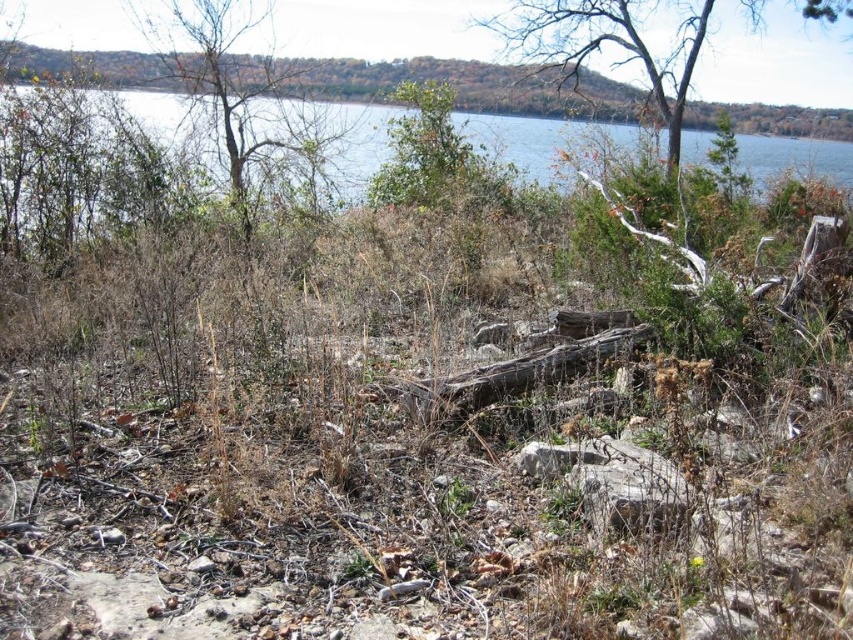
You are a photographer planning to capture the entire blue water at upper center and bare wood tree at upper center in one frame. Based on their widths, which object would require you to adjust your camera angle to ensure both fit in the photo?

The blue water at upper center is wider than the bare wood tree at upper center, so you would need to adjust your camera angle to accommodate its greater width to ensure both fit in the photo.

You are a hiker standing at the lakeside and want to cross to the other side. You notice the blue water at upper center and the bare wood tree at upper center. Which one is closer to you?

The blue water at upper center is located below the bare wood tree at upper center, so the blue water at upper center is closer to you.

You are an environmental scientist assessing the health of trees in this lakeside area. You observe the bare wood tree at upper center and the brown rough tree trunk at center. Which tree has a wider trunk?

The bare wood tree at upper center has a wider trunk than the brown rough tree trunk at center, as stated in the description.